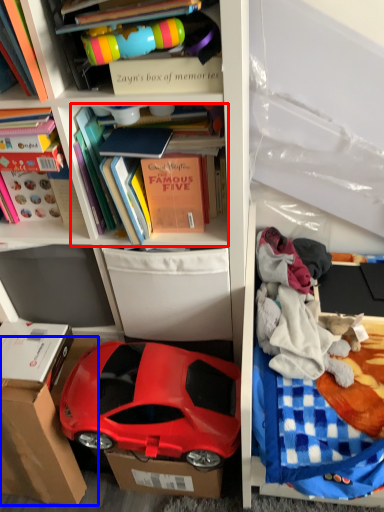
Question: Which of the following is the farthest to the observer, book (highlighted by a red box) or cardboard box (highlighted by a blue box)?

Choices:
 (A) book
 (B) cardboard box

Answer: (B)